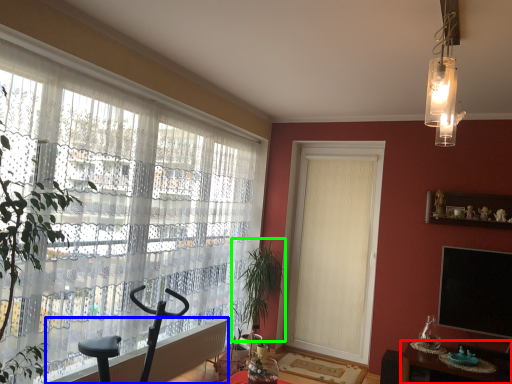
Question: Estimate the real-world distances between objects in this image. Which object is farther from table (highlighted by a red box), radiator (highlighted by a blue box) or plant (highlighted by a green box)?

Choices:
 (A) radiator
 (B) plant

Answer: (A)